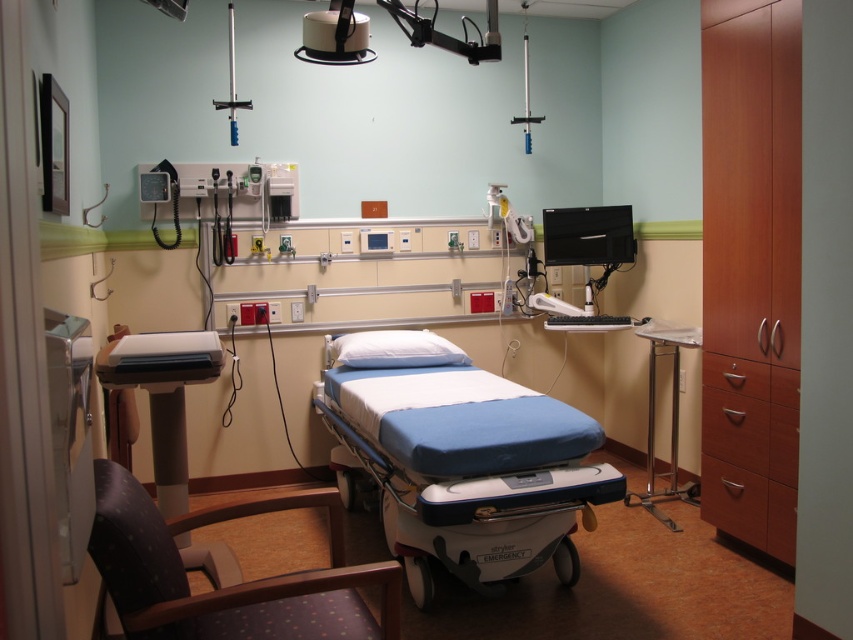
You are a medical technician in the examination room. You need to place a small medical kit between the two points labeled point [383,387] and point [119,588]. Which point should the kit be closer to if it needs to be nearer to the viewer?

The medical kit should be placed closer to point [383,387] because it is further to the viewer than point [119,588].

You are a medical technician standing at the camera position in the room. You need to reach a specific point marked at coordinates point (194, 616). Can you comfortably reach this point without moving your position?

The distance of point (194, 616) from the camera is 1.53 meters. Since the average comfortable reaching distance for a person is typically around 1.2 to 1.5 meters, you might be able to reach it but it could be slightly out of comfortable range depending on your arm length.

You are a nurse preparing to adjust the height of the blue fabric bed at center so that it aligns with the height of the satin silver monitor at upper right. Given that the monitor cannot be moved, is it possible to lower the bed to match the monitor height?

The blue fabric bed at center is much taller than the satin silver monitor at upper right. Since the monitor cannot be moved, lowering the bed to match the monitor height is possible as long as the bed has a lowering mechanism that can reach the monitor height.